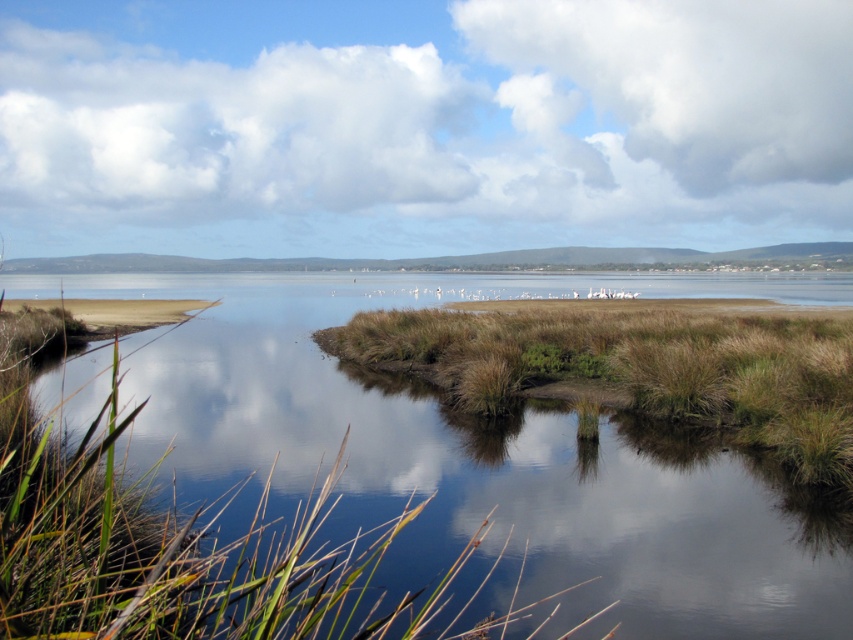
In the scene shown: You are a bird flying over the serene natural landscape. You need to land on the tallest grassy area between the green grassy land at center and the brown grassy island at center. Which area should you choose?

The green grassy land at center has a greater height compared to the brown grassy island at center, so you should choose the green grassy land at center to land.

Consider the image. You are a bird flying over the serene natural landscape. You see the green grassy land at center and the brown grassy island at center. Which one is above the other?

The green grassy land at center is positioned over brown grassy island at center, so the green grassy land at center is above the brown grassy island at center.

You are standing at the edge of the water in the scene and want to reach the two points marked in the image. Which point, point (x=247, y=467) or point (x=378, y=337), is closer to you?

Point (x=247, y=467) is closer to you than point (x=378, y=337).